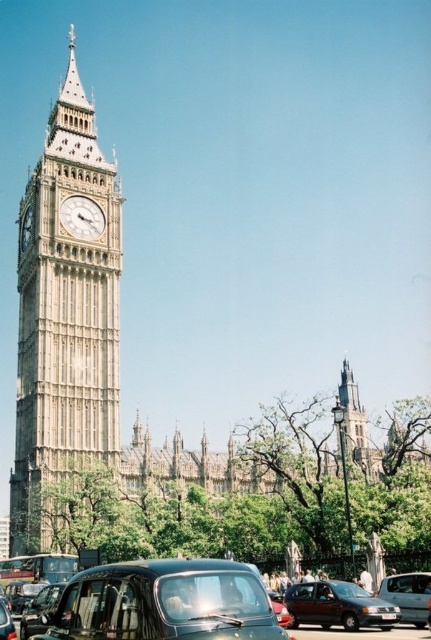
Question: Which of the following is the closest to the observer?

Choices:
 (A) (421, 602)
 (B) (97, 236)
 (C) (427, 570)
 (D) (389, 616)

Answer: (D)

Question: Which object is the closest to the black rubber car at lower center?

Choices:
 (A) black plastic license plate at center
 (B) stone clock tower at left
 (C) metallic maroon hatchback at lower right
 (D) white marble clock at center

Answer: (C)

Question: From the image, what is the correct spatial relationship of stone clock tower at left in relation to white stone clock at center-left?

Choices:
 (A) below
 (B) above

Answer: (A)

Question: Can you confirm if black rubber car at lower center is positioned below white marble clock at center?

Choices:
 (A) yes
 (B) no

Answer: (A)

Question: Can you confirm if stone clock tower at left is positioned below black rubber car at lower center?

Choices:
 (A) yes
 (B) no

Answer: (B)

Question: Which object appears closest to the camera in this image?

Choices:
 (A) black rubber car at lower center
 (B) white stone clock at center-left
 (C) white marble clock at center

Answer: (A)